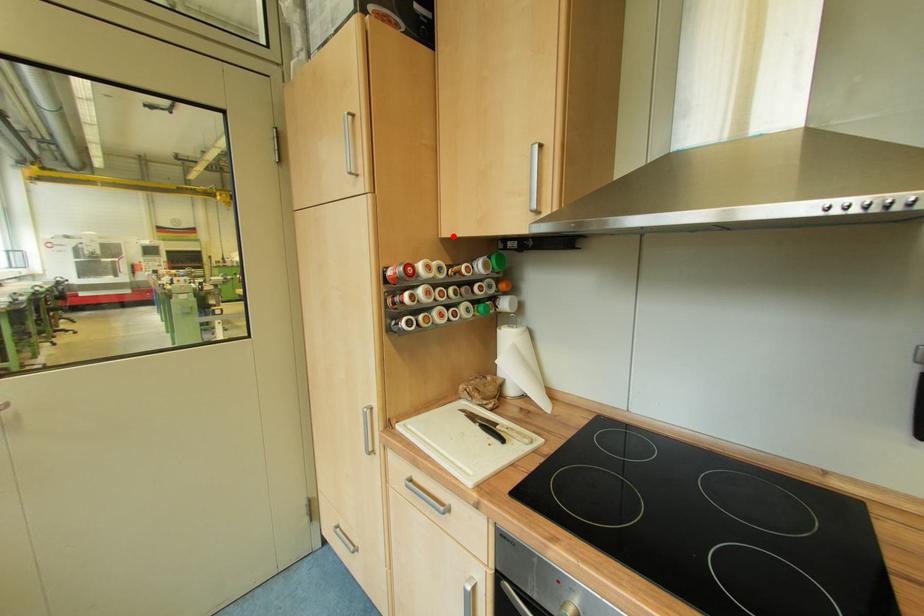
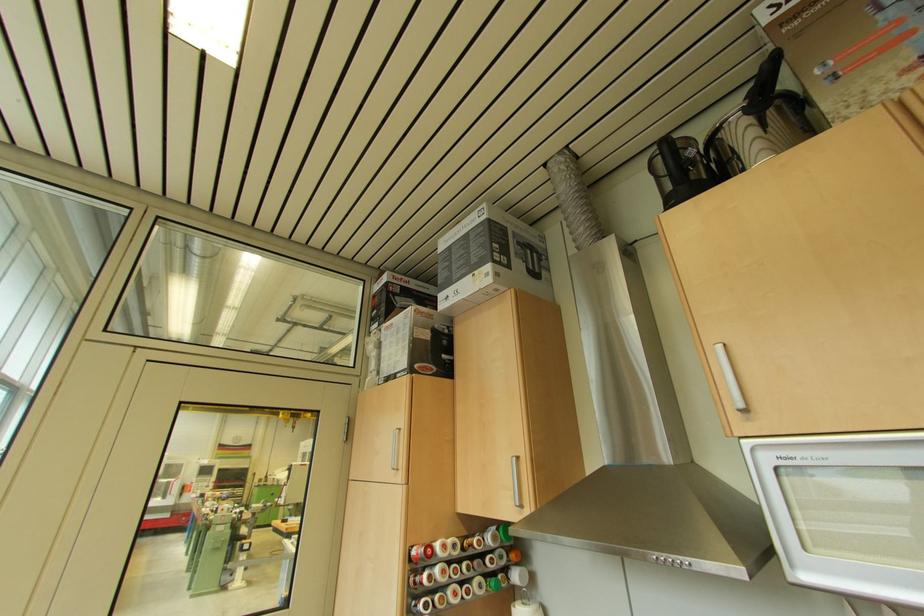
Find the pixel in the second image that matches the highlighted location in the first image.

(468, 513)